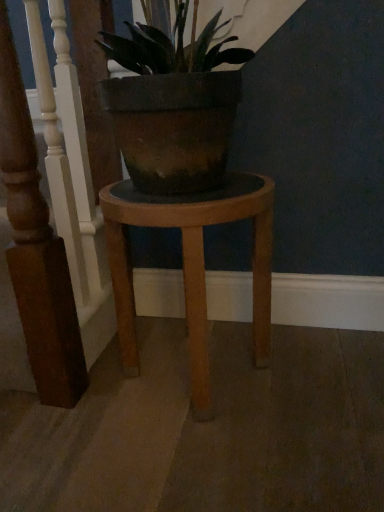
Question: Is white painted wood railing at left wider than wooden stool at center?

Choices:
 (A) yes
 (B) no

Answer: (B)

Question: Is white painted wood railing at left closer to camera compared to wooden stool at center?

Choices:
 (A) yes
 (B) no

Answer: (A)

Question: Is white painted wood railing at left thinner than wooden stool at center?

Choices:
 (A) yes
 (B) no

Answer: (A)

Question: Is white painted wood railing at left to the right of wooden stool at center from the viewer's perspective?

Choices:
 (A) no
 (B) yes

Answer: (A)

Question: Can you confirm if white painted wood railing at left is smaller than wooden stool at center?

Choices:
 (A) yes
 (B) no

Answer: (A)

Question: Can you confirm if white painted wood railing at left is bigger than wooden stool at center?

Choices:
 (A) yes
 (B) no

Answer: (B)

Question: From the image's perspective, is wooden stool at center above white painted wood railing at left?

Choices:
 (A) yes
 (B) no

Answer: (B)

Question: Is wooden stool at center at the right side of white painted wood railing at left?

Choices:
 (A) no
 (B) yes

Answer: (B)

Question: Considering the relative sizes of wooden stool at center and white painted wood railing at left in the image provided, is wooden stool at center shorter than white painted wood railing at left?

Choices:
 (A) yes
 (B) no

Answer: (A)

Question: Does wooden stool at center have a greater width compared to white painted wood railing at left?

Choices:
 (A) no
 (B) yes

Answer: (B)

Question: Is wooden stool at center further to camera compared to white painted wood railing at left?

Choices:
 (A) yes
 (B) no

Answer: (A)

Question: From the image's perspective, is wooden stool at center below white painted wood railing at left?

Choices:
 (A) no
 (B) yes

Answer: (B)

Question: Choose the correct answer: Is wooden stool at center inside white painted wood railing at left or outside it?

Choices:
 (A) outside
 (B) inside

Answer: (A)